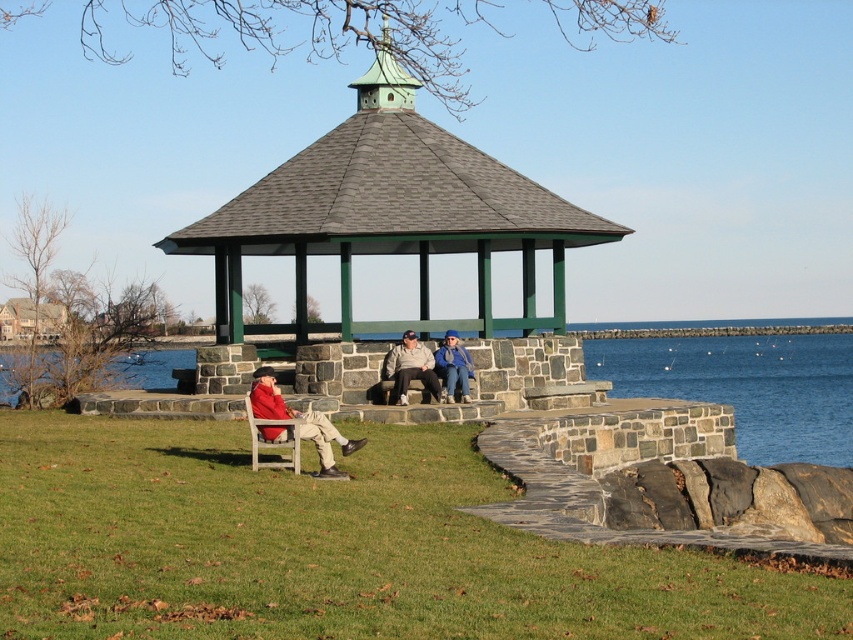
You are planning to host a small gathering and need to seat two guests. You have a matte red jacket at lower left and a matte gray stone bench at center available. Which object can accommodate more people?

The matte gray stone bench at center can accommodate more people because it occupies more space than the matte red jacket at lower left.

You are standing in the gazebo and want to sit down. There is a matte gray stone bench at center and a blue denim jacket at center. Which object is closer to your right side?

The blue denim jacket at center is to the right of the matte gray stone bench at center, so if you are facing the bench, the blue denim jacket at center would be on your right side.